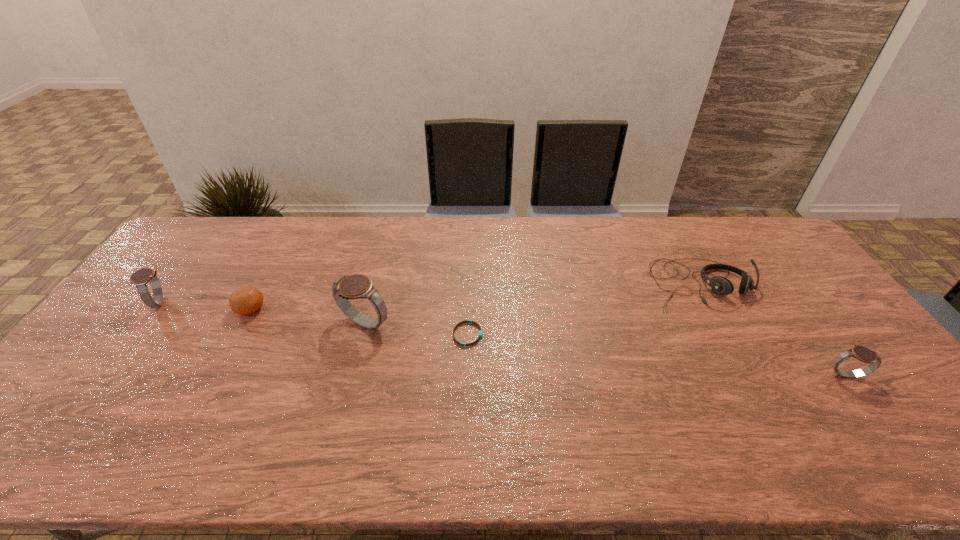
The height and width of the screenshot is (540, 960). In order to click on the leftmost watch in this screenshot , I will do `click(140, 278)`.

At what (x,y) coordinates should I click in order to perform the action: click on the fifth shortest object. Please return your answer as a coordinate pair (x, y). Looking at the image, I should click on (140, 278).

At what (x,y) coordinates should I click in order to perform the action: click on the fourth object from right to left. Please return your answer as a coordinate pair (x, y). This screenshot has height=540, width=960. Looking at the image, I should click on (357, 286).

Image resolution: width=960 pixels, height=540 pixels. What are the coordinates of `the tallest watch` in the screenshot? It's located at (357, 286).

Find the location of a particular element. The image size is (960, 540). the nearest watch is located at coordinates (861, 353).

Find the location of a particular element. the shortest watch is located at coordinates (861, 353).

Find the location of a particular element. Image resolution: width=960 pixels, height=540 pixels. headset is located at coordinates (719, 284).

Locate an element on the screen. The height and width of the screenshot is (540, 960). wristband is located at coordinates 480,334.

The width and height of the screenshot is (960, 540). Identify the location of the shortest object. (480, 334).

Find the location of a particular element. The image size is (960, 540). the second object from left to right is located at coordinates (247, 300).